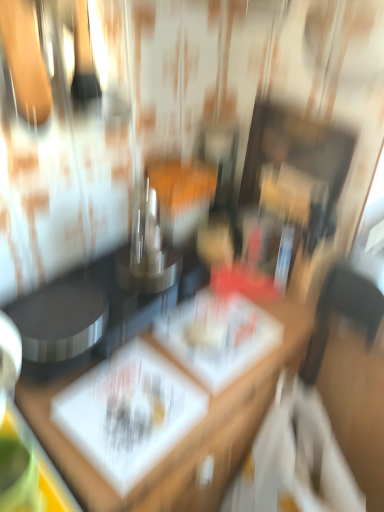
This screenshot has width=384, height=512. I want to click on vacant area on top of wooden table at center (from a real-world perspective), so click(x=192, y=335).